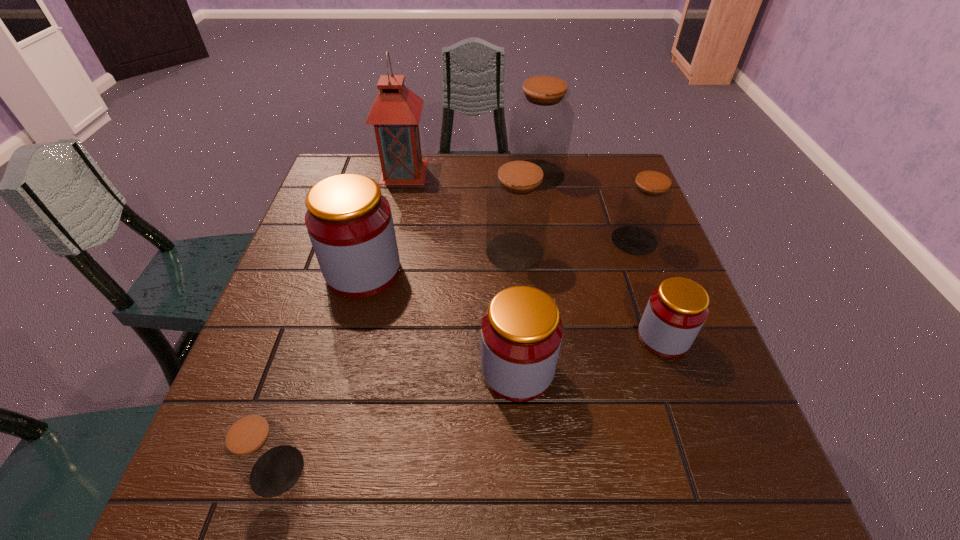
What are the coordinates of `object that is the fifth closest to the rightmost brown jar` in the screenshot? It's located at (349, 222).

The height and width of the screenshot is (540, 960). In order to click on jar object that ranks as the sixth closest to the rightmost brown jar in this screenshot , I will do `click(259, 450)`.

Identify which jar is the closest to the pink lantern. Please provide its 2D coordinates. Your answer should be formatted as a tuple, i.e. [(x, y)], where the tuple contains the x and y coordinates of a point satisfying the conditions above.

[(541, 121)]

Locate an element on the screen. The image size is (960, 540). brown jar that is the third closest to the second red jar from right to left is located at coordinates (645, 205).

Point out which brown jar is positioned as the fourth nearest to the pink lantern. Please provide its 2D coordinates. Your answer should be formatted as a tuple, i.e. [(x, y)], where the tuple contains the x and y coordinates of a point satisfying the conditions above.

[(259, 450)]

Image resolution: width=960 pixels, height=540 pixels. What are the coordinates of `red jar that is the second closest to the biggest red jar` in the screenshot? It's located at (676, 311).

You are a GUI agent. You are given a task and a screenshot of the screen. Output one action in this format:
    pyautogui.click(x=<x>, y=<y>)
    Task: Click on the red jar identified as the closest to the smallest red jar
    
    Given the screenshot: What is the action you would take?
    pyautogui.click(x=521, y=333)

You are a GUI agent. You are given a task and a screenshot of the screen. Output one action in this format:
    pyautogui.click(x=<x>, y=<y>)
    Task: Click on the free point that satisfies the following two spatial constraints: 1. on the front side of the second smallest brown jar; 2. on the right side of the lantern
    This screenshot has width=960, height=540.
    Given the screenshot: What is the action you would take?
    click(x=389, y=240)

Locate an element on the screen. The height and width of the screenshot is (540, 960). free space in the image that satisfies the following two spatial constraints: 1. on the front side of the lantern; 2. on the left side of the rightmost brown jar is located at coordinates (389, 240).

Identify the location of free space that satisfies the following two spatial constraints: 1. on the front side of the rightmost brown jar; 2. on the right side of the second tallest object. (546, 240).